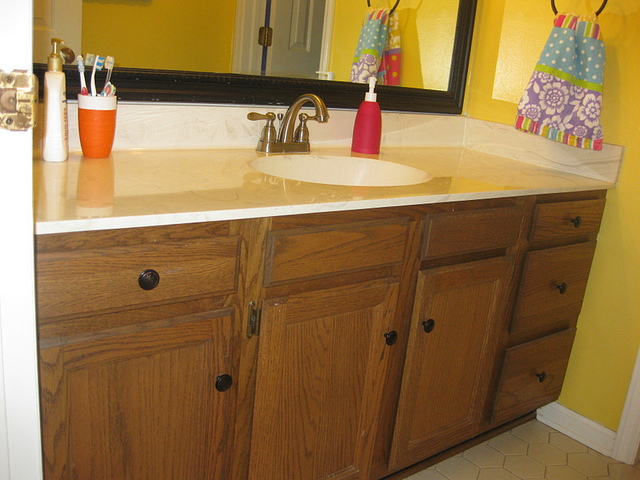
Locate an element on the screen. The height and width of the screenshot is (480, 640). drawer is located at coordinates (177, 287).